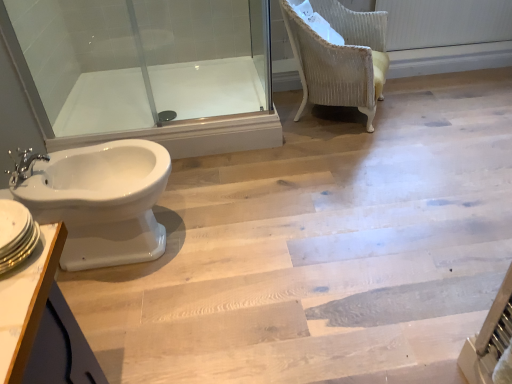
Locate an element on the screen. This screenshot has width=512, height=384. vacant region to the right of velvet yellow chair at upper right is located at coordinates coord(417,109).